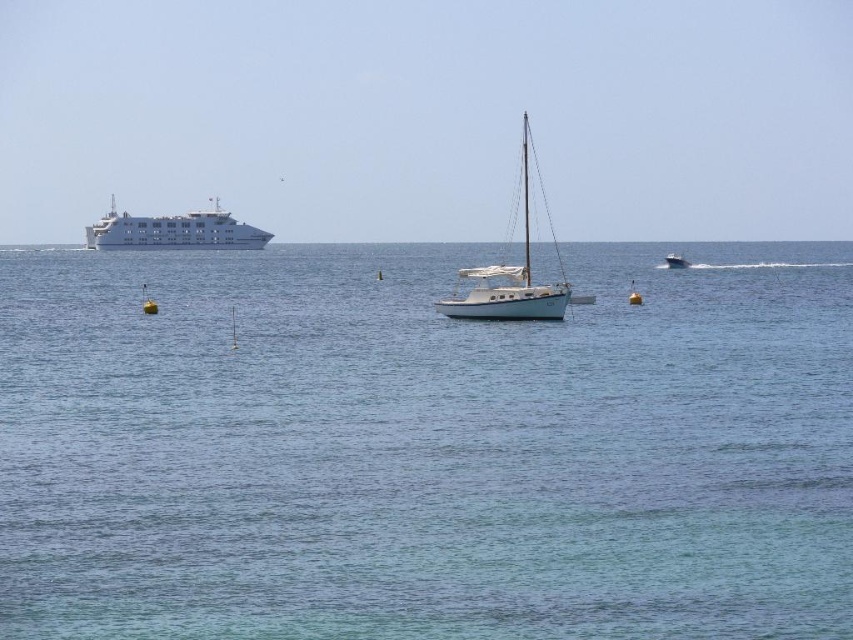
You are a pilot flying a small aircraft and need to land on the water. You see the white glossy cruise ship at left and the metallic blue boat at center. Which one is closer to you?

The white glossy cruise ship at left is closer to you because the metallic blue boat at center is positioned behind it.

You are a marine biologist observing the seascape. You need to determine which vessel is bigger between the white glossy cruise ship at left and the metallic blue boat at center. Which one is larger?

The white glossy cruise ship at left is larger compared to the metallic blue boat at center according to the description.